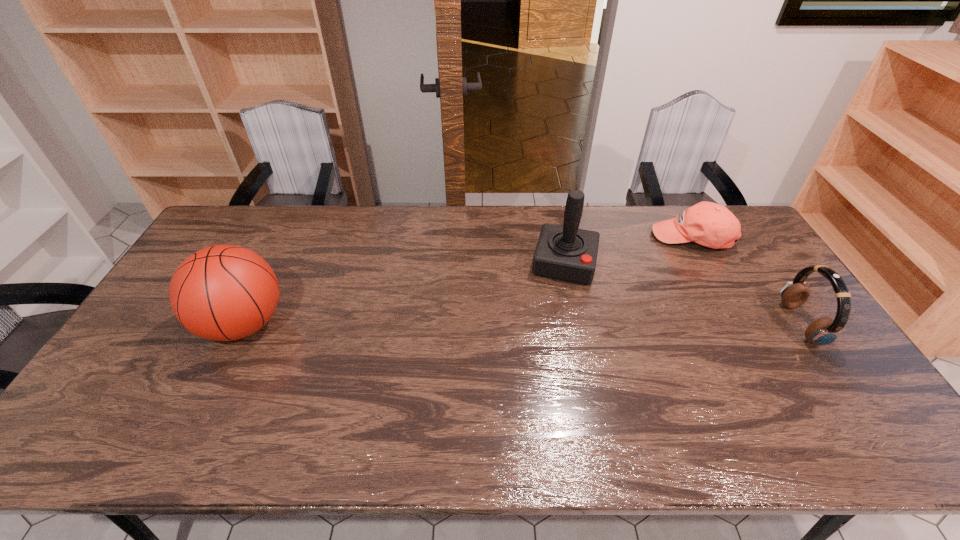
This screenshot has height=540, width=960. Find the location of `baseball cap present at the right edge`. baseball cap present at the right edge is located at coordinates (709, 224).

Image resolution: width=960 pixels, height=540 pixels. In order to click on object at the far right corner in this screenshot , I will do `click(709, 224)`.

The width and height of the screenshot is (960, 540). I want to click on free space at the far edge of the desktop, so click(376, 214).

At what (x,y) coordinates should I click in order to perform the action: click on vacant space at the far left corner. Please return your answer as a coordinate pair (x, y). The height and width of the screenshot is (540, 960). Looking at the image, I should click on tap(223, 217).

Where is `free space between the third object from right to left and the rightmost object`? Image resolution: width=960 pixels, height=540 pixels. free space between the third object from right to left and the rightmost object is located at coordinates (683, 294).

You are a GUI agent. You are given a task and a screenshot of the screen. Output one action in this format:
    pyautogui.click(x=<x>, y=<y>)
    Task: Click on the free spot between the third object from right to left and the rightmost object
    Image resolution: width=960 pixels, height=540 pixels.
    Given the screenshot: What is the action you would take?
    pyautogui.click(x=683, y=294)

Where is `free point between the shortest object and the basketball`? free point between the shortest object and the basketball is located at coordinates (468, 281).

The width and height of the screenshot is (960, 540). In order to click on vacant area that lies between the third tallest object and the leftmost object in this screenshot , I will do `click(522, 324)`.

Identify the location of vacant area between the basketball and the third object from right to left. This screenshot has height=540, width=960. (404, 294).

At what (x,y) coordinates should I click in order to perform the action: click on empty space between the headset and the leftmost object. Please return your answer as a coordinate pair (x, y). Looking at the image, I should click on (522, 324).